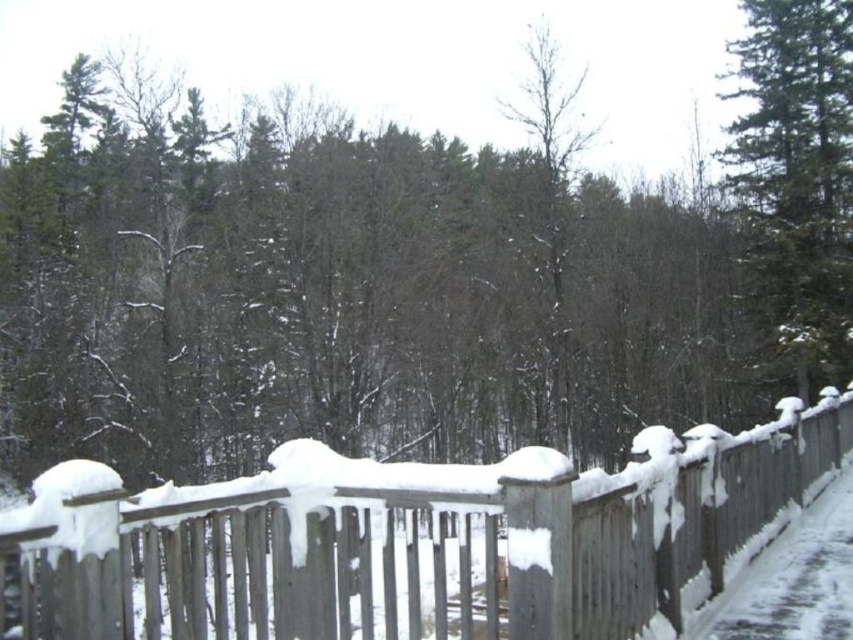
Question: Considering the relative positions of snow-covered wooden fence at center and green evergreen tree at upper right in the image provided, where is snow-covered wooden fence at center located with respect to green evergreen tree at upper right?

Choices:
 (A) above
 (B) below

Answer: (B)

Question: Considering the relative positions of snow-covered wooden fence at center and green evergreen tree at upper right in the image provided, where is snow-covered wooden fence at center located with respect to green evergreen tree at upper right?

Choices:
 (A) left
 (B) right

Answer: (A)

Question: Does snow-covered wooden fence at center appear on the left side of green evergreen tree at upper right?

Choices:
 (A) no
 (B) yes

Answer: (B)

Question: Which object appears closest to the camera in this image?

Choices:
 (A) snow-covered wooden fence at center
 (B) green evergreen tree at upper right

Answer: (A)

Question: Among these points, which one is farthest from the camera?

Choices:
 (A) (329, 541)
 (B) (802, 380)

Answer: (B)